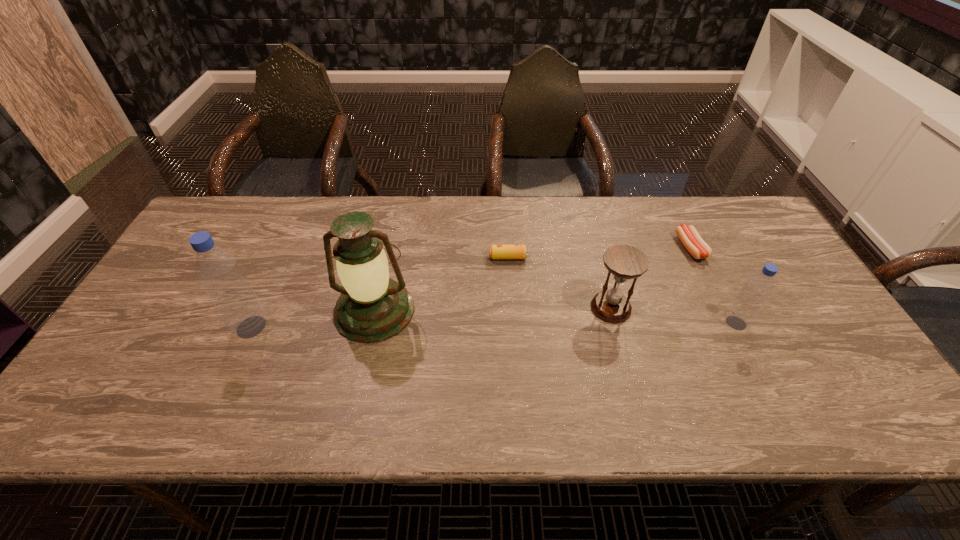
Identify the location of vacant space located on the left of the fourth object from left to right. (489, 308).

This screenshot has width=960, height=540. Identify the location of blank area located on the left of the fourth object from right to left. (412, 258).

The width and height of the screenshot is (960, 540). I want to click on free space located with the light compartment facing forward on the lantern, so click(x=361, y=372).

You are a GUI agent. You are given a task and a screenshot of the screen. Output one action in this format:
    pyautogui.click(x=<x>, y=<y>)
    Task: Click on the object present at the far edge
    The width and height of the screenshot is (960, 540).
    Given the screenshot: What is the action you would take?
    pos(695,245)

Find the location of a particular element. Image resolution: width=960 pixels, height=540 pixels. vacant area at the far edge of the desktop is located at coordinates (598, 239).

In the image, there is a desktop. What are the coordinates of `vacant space at the left edge` in the screenshot? It's located at (187, 315).

This screenshot has height=540, width=960. What are the coordinates of `vacant space at the right edge of the desktop` in the screenshot? It's located at (780, 278).

This screenshot has height=540, width=960. In order to click on vacant space at the near left corner in this screenshot , I will do `click(144, 359)`.

At what (x,y) coordinates should I click in order to perform the action: click on free space at the far right corner of the desktop. Please return your answer as a coordinate pair (x, y). The image size is (960, 540). Looking at the image, I should click on (737, 224).

At what (x,y) coordinates should I click in order to perform the action: click on unoccupied area between the fifth object from right to left and the hourglass. Please return your answer as a coordinate pair (x, y). The width and height of the screenshot is (960, 540). Looking at the image, I should click on (492, 309).